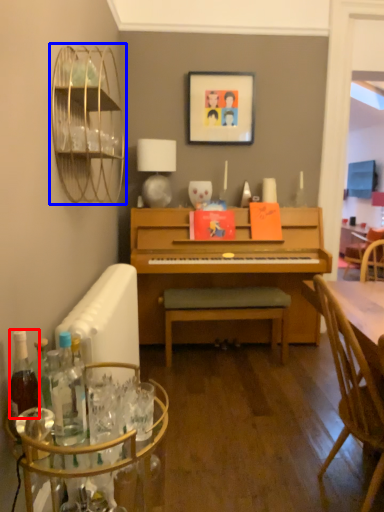
Question: Among these objects, which one is nearest to the camera, bottle (highlighted by a red box) or bird cage (highlighted by a blue box)?

Choices:
 (A) bottle
 (B) bird cage

Answer: (A)